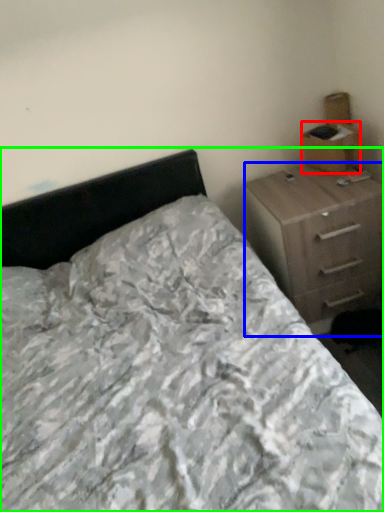
Question: Estimate the real-world distances between objects in this image. Which object is closer to cardboard box (highlighted by a red box), chest of drawers (highlighted by a blue box) or bed (highlighted by a green box)?

Choices:
 (A) chest of drawers
 (B) bed

Answer: (A)